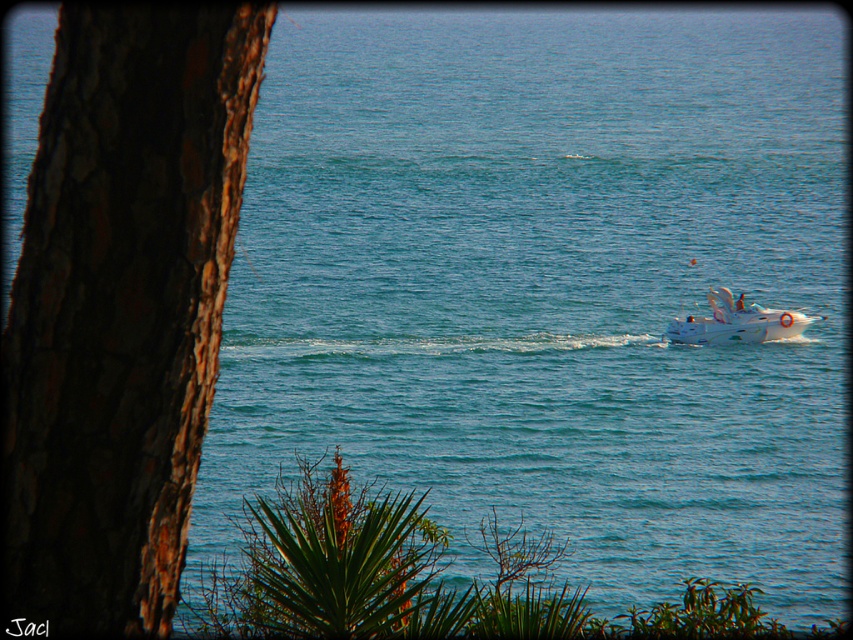
Question: Which of the following is the closest to the observer?

Choices:
 (A) (180, 58)
 (B) (786, 317)

Answer: (A)

Question: Which point is farther from the camera taking this photo?

Choices:
 (A) (148, 307)
 (B) (764, 339)

Answer: (B)

Question: Is brown rough bark tree at left further to camera compared to white glossy boat at right?

Choices:
 (A) no
 (B) yes

Answer: (A)

Question: Does brown rough bark tree at left have a smaller size compared to white glossy boat at right?

Choices:
 (A) no
 (B) yes

Answer: (B)

Question: Is brown rough bark tree at left further to camera compared to white glossy boat at right?

Choices:
 (A) no
 (B) yes

Answer: (A)